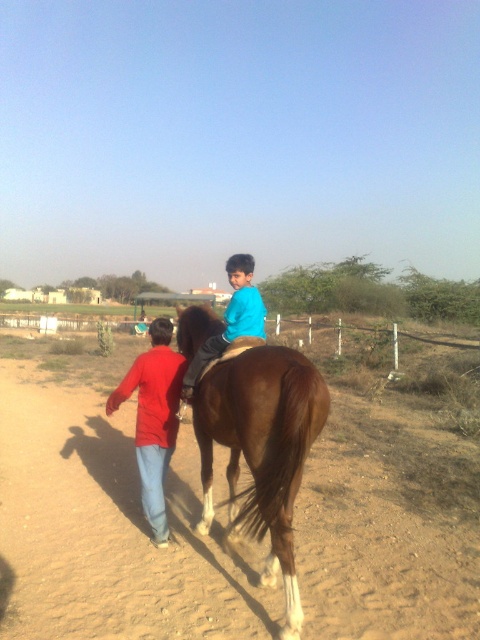
You are standing on the dirt path in the rural scene and want to walk towards the two points marked in the image. Which point, point [160,358] or point [191,392], should you head toward if you want to reach the one closer to you first?

You should head toward point [160,358] first because it is closer to you than point [191,392].

You are a photographer positioned at the starting point of the dirt path. You want to capture a photo of both the red cotton shirt at left and the blue matte shirt at center in the same frame. Based on their positions, which shirt should you focus on first to ensure both are in focus?

The blue matte shirt at center is behind the red cotton shirt at left, so you should focus on the blue matte shirt at center first to ensure both are in focus.